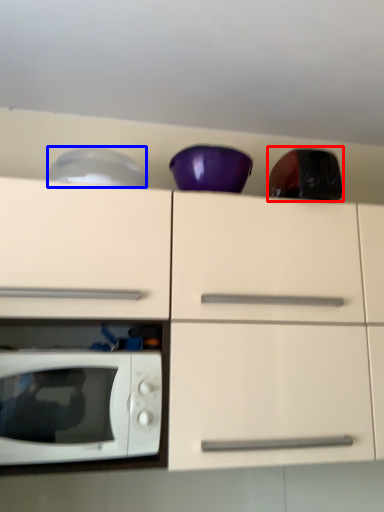
Question: Which point is closer to the camera, appliance (highlighted by a red box) or appliance (highlighted by a blue box)?

Choices:
 (A) appliance
 (B) appliance

Answer: (A)